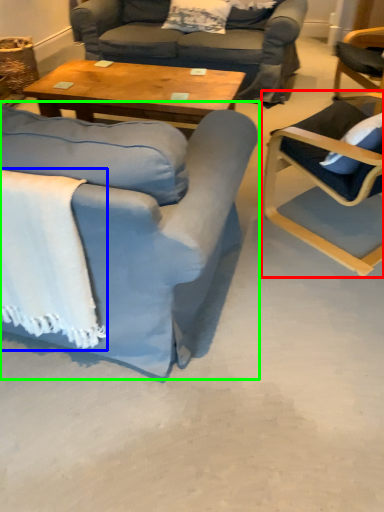
Question: Which object is positioned closest to chair (highlighted by a red box)? Select from blanket (highlighted by a blue box) and chair (highlighted by a green box).

Choices:
 (A) blanket
 (B) chair

Answer: (B)